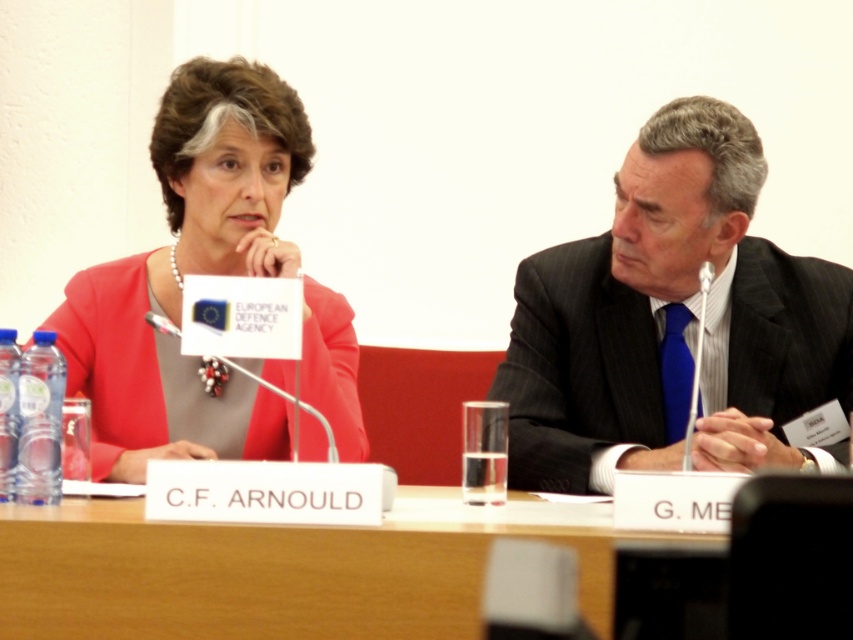
You are organizing a photo shoot and need to ensure that all items in the frame are proportionally accurate. Given the scene described, can the dark gray pinstripe suit at right and the brown wood table at center be arranged so that the table appears larger than the suit in the final image?

The dark gray pinstripe suit at right is bigger than the brown wood table at center, so arranging the table to appear larger would require adjusting the camera angle or perspective to make the table look bigger, as their actual sizes are fixed.

You are standing at the entrance of the conference room. You need to place a 1.5 meter long banner on the brown wood table at center. Is there enough space on the table to place the banner without overlapping any nameplates?

The banner can be placed on the brown wood table at center as long as it does not overlap the nameplates, but the exact dimensions of the table are not provided. However, since the table is at point coordinates, it might be large enough to accommodate the banner if positioned carefully.

You are standing in the room where the formal meeting is taking place. You need to hand a document to the person wearing the dark gray pinstripe suit at right. Considering your height is 5 feet 6 inches, can you comfortably reach the person without moving closer than the current distance?

The dark gray pinstripe suit at right and viewer are 5.65 feet apart from each other. Since the viewer is 5 feet 6 inches tall, they can comfortably reach the person at this distance without needing to move closer.